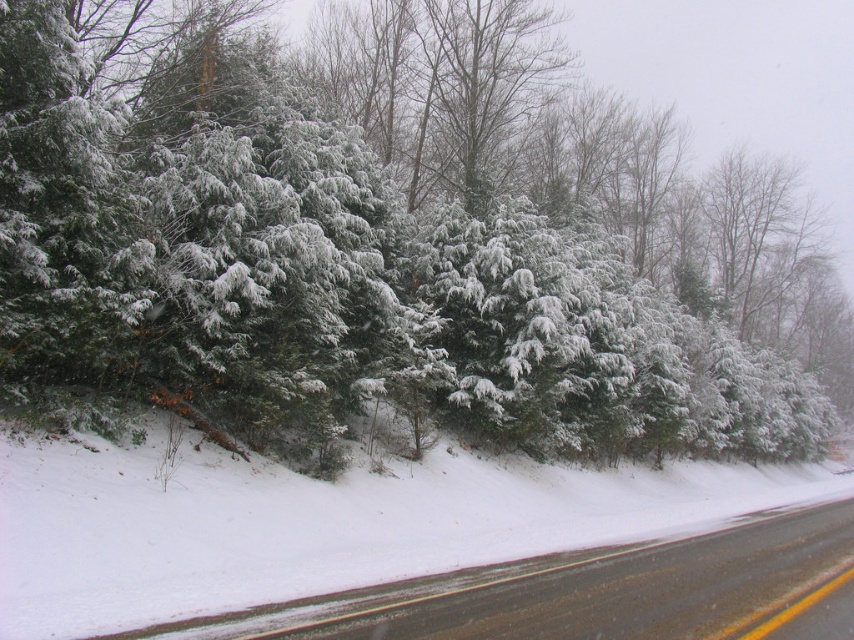
Can you confirm if green matte evergreen trees at upper left is positioned to the right of black asphalt road at lower right?

Indeed, green matte evergreen trees at upper left is positioned on the right side of black asphalt road at lower right.

Which is above, green matte evergreen trees at upper left or black asphalt road at lower right?

green matte evergreen trees at upper left

Is point (36, 90) farther from camera compared to point (699, 592)?

Yes, point (36, 90) is behind point (699, 592).

This screenshot has height=640, width=854. In order to click on green matte evergreen trees at upper left in this screenshot , I will do `click(387, 241)`.